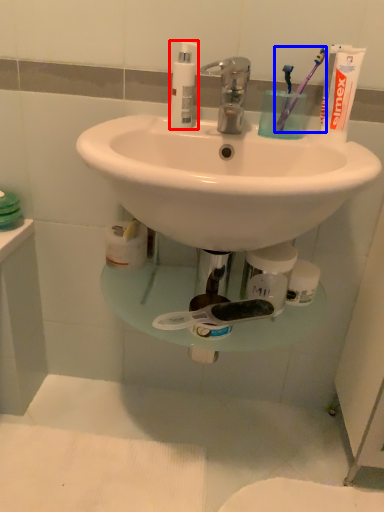
Question: Which of the following is the closest to the observer, soap dispenser (highlighted by a red box) or toothbrush (highlighted by a blue box)?

Choices:
 (A) soap dispenser
 (B) toothbrush

Answer: (B)